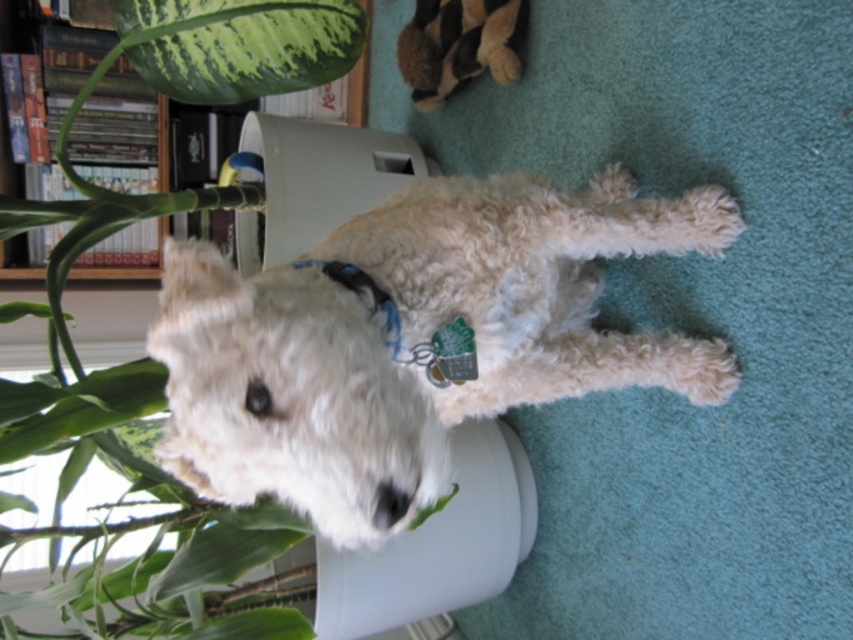
Question: Is the position of soft plush toy at upper center more distant than that of wooden bookshelf at upper left?

Choices:
 (A) yes
 (B) no

Answer: (B)

Question: Based on their relative distances, which object is farther from the white fluffy dog at center?

Choices:
 (A) soft plush toy at upper center
 (B) wooden bookshelf at upper left
 (C) blue fabric neckband at center

Answer: (B)

Question: Is the position of soft plush toy at upper center less distant than that of wooden bookshelf at upper left?

Choices:
 (A) yes
 (B) no

Answer: (A)

Question: Can you confirm if white fluffy dog at center is positioned to the left of wooden bookshelf at upper left?

Choices:
 (A) no
 (B) yes

Answer: (A)

Question: Which of the following is the closest to the observer?

Choices:
 (A) (596, 291)
 (B) (483, 38)
 (C) (326, 269)

Answer: (C)

Question: Which of these objects is positioned closest to the white fluffy dog at center?

Choices:
 (A) wooden bookshelf at upper left
 (B) soft plush toy at upper center

Answer: (B)